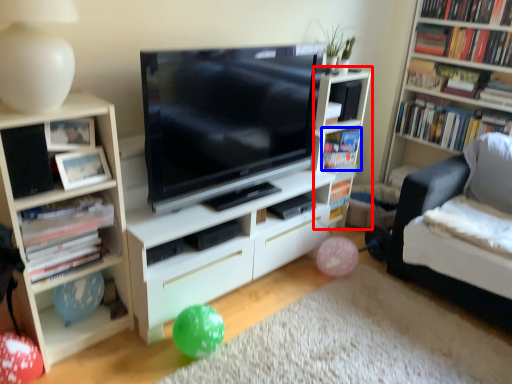
Question: Which point is closer to the camera, shelf (highlighted by a red box) or book (highlighted by a blue box)?

Choices:
 (A) shelf
 (B) book

Answer: (A)